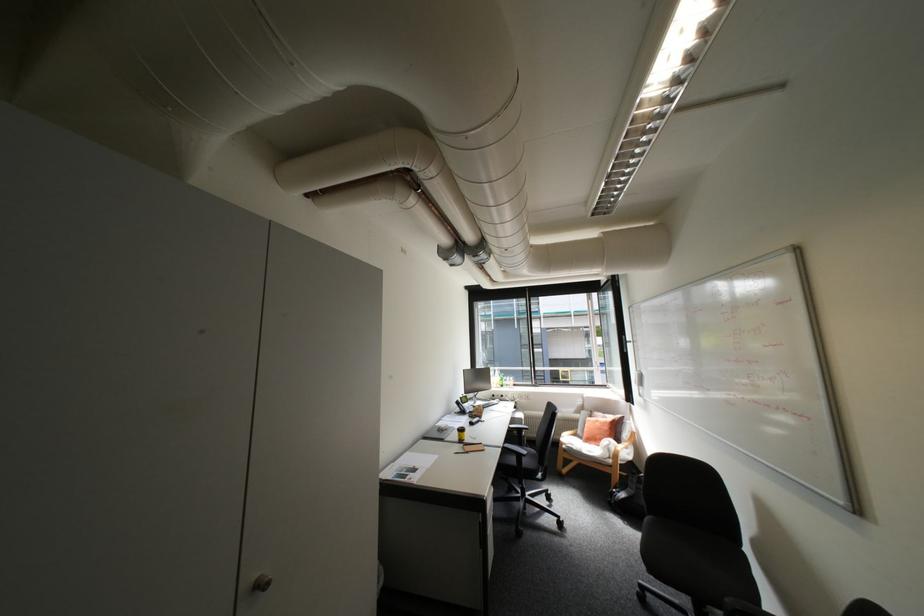
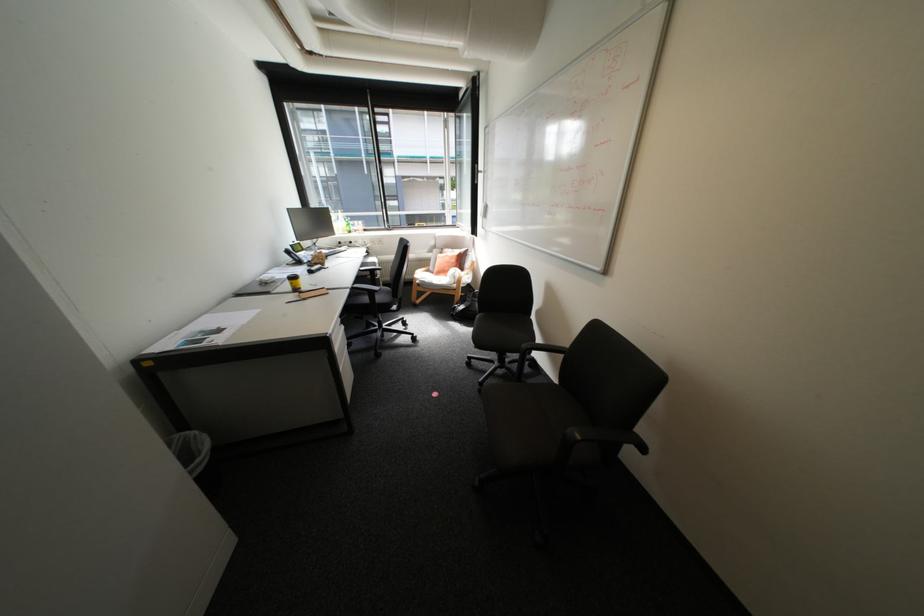
Where in the second image is the point corresponding to point (611, 415) from the first image?

(459, 249)